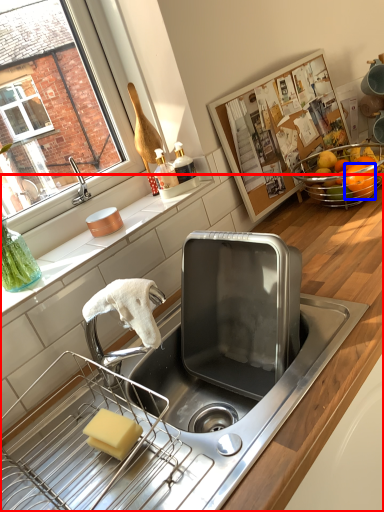
Question: Which point is closer to the camera, countertop (highlighted by a red box) or orange (highlighted by a blue box)?

Choices:
 (A) countertop
 (B) orange

Answer: (A)